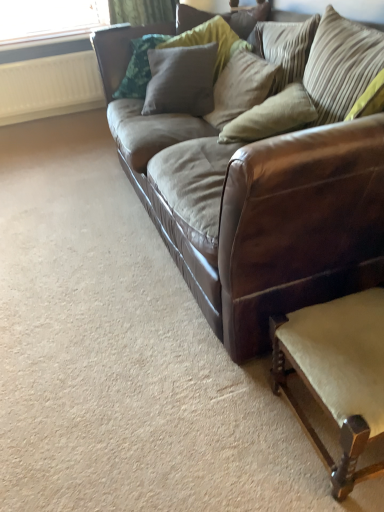
Question: Considering the relative sizes of beige fabric pillow at center, the third pillow positioned from the left, and striped fabric pillow at upper right, the fourth pillow positioned from the left, in the image provided, is beige fabric pillow at center, the third pillow positioned from the left, bigger than striped fabric pillow at upper right, the fourth pillow positioned from the left,?

Choices:
 (A) yes
 (B) no

Answer: (B)

Question: Is beige fabric pillow at center, the third pillow positioned from the left, located outside striped fabric pillow at upper right, placed as the 1th pillow when sorted from right to left?

Choices:
 (A) yes
 (B) no

Answer: (A)

Question: Is beige fabric pillow at center, which is the second pillow from right to left, at the left side of striped fabric pillow at upper right, placed as the 1th pillow when sorted from right to left?

Choices:
 (A) yes
 (B) no

Answer: (A)

Question: Is beige fabric pillow at center, which is the second pillow from right to left, facing away from striped fabric pillow at upper right, the fourth pillow positioned from the left?

Choices:
 (A) no
 (B) yes

Answer: (A)

Question: From the image's perspective, is beige fabric pillow at center, the third pillow positioned from the left, on striped fabric pillow at upper right, placed as the 1th pillow when sorted from right to left?

Choices:
 (A) no
 (B) yes

Answer: (A)

Question: Is textured beige pillow at upper center, which is the 2th pillow in left-to-right order, taller or shorter than light beige fabric swivel chair at lower right?

Choices:
 (A) short
 (B) tall

Answer: (B)

Question: Is textured beige pillow at upper center, arranged as the 3th pillow when viewed from the right, spatially inside light beige fabric swivel chair at lower right, or outside of it?

Choices:
 (A) outside
 (B) inside

Answer: (A)

Question: Considering their positions, is textured beige pillow at upper center, arranged as the 3th pillow when viewed from the right, located in front of or behind light beige fabric swivel chair at lower right?

Choices:
 (A) front
 (B) behind

Answer: (B)

Question: Based on their sizes in the image, would you say textured beige pillow at upper center, arranged as the 3th pillow when viewed from the right, is bigger or smaller than light beige fabric swivel chair at lower right?

Choices:
 (A) big
 (B) small

Answer: (A)

Question: In terms of size, does brown leather couch at center appear bigger or smaller than beige fabric pillow at center, the third pillow positioned from the left?

Choices:
 (A) big
 (B) small

Answer: (A)

Question: Is brown leather couch at center inside or outside of beige fabric pillow at center, the third pillow positioned from the left?

Choices:
 (A) inside
 (B) outside

Answer: (B)

Question: Based on their positions, is brown leather couch at center located to the left or right of beige fabric pillow at center, which is the second pillow from right to left?

Choices:
 (A) right
 (B) left

Answer: (B)

Question: Does point [329, 229] appear closer or farther from the camera than point [299, 111]?

Choices:
 (A) closer
 (B) farther

Answer: (A)

Question: Considering the positions of textured gray pillow at upper center, the 4th pillow from the right, and brown leather couch at center in the image, is textured gray pillow at upper center, the 4th pillow from the right, wider or thinner than brown leather couch at center?

Choices:
 (A) thin
 (B) wide

Answer: (A)

Question: Is point (228, 58) closer or farther from the camera than point (187, 272)?

Choices:
 (A) closer
 (B) farther

Answer: (B)